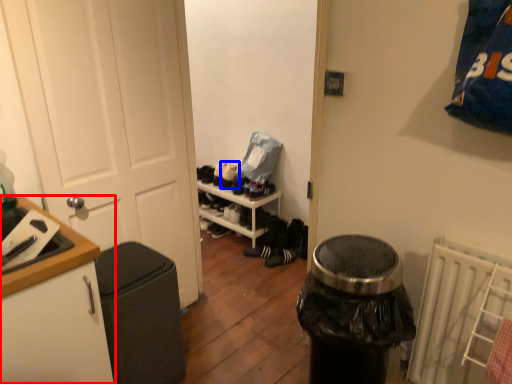
Question: Which of the following is the closest to the observer, cabinetry (highlighted by a red box) or shoe (highlighted by a blue box)?

Choices:
 (A) cabinetry
 (B) shoe

Answer: (A)